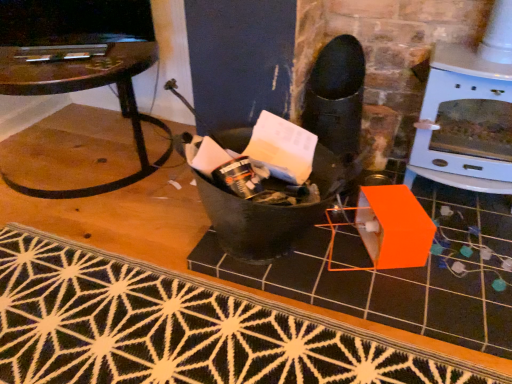
You are a GUI agent. You are given a task and a screenshot of the screen. Output one action in this format:
    pyautogui.click(x=<x>, y=<y>)
    Task: Click on the free region under black textured rug at lower center (from a real-world perspective)
    Image resolution: width=512 pixels, height=384 pixels.
    Given the screenshot: What is the action you would take?
    pyautogui.click(x=163, y=322)